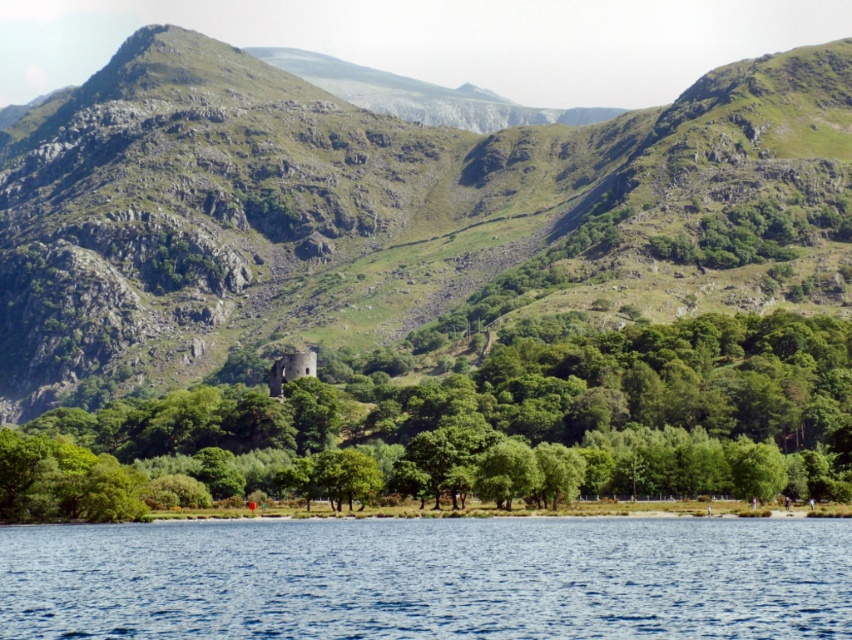
Question: Is green rocky mountain at center above blue liquid water at lower center?

Choices:
 (A) no
 (B) yes

Answer: (B)

Question: Which point is farther from the camera taking this photo?

Choices:
 (A) (32, 275)
 (B) (308, 442)

Answer: (A)

Question: Does green rocky mountain at center appear over green leafy tree at center?

Choices:
 (A) no
 (B) yes

Answer: (B)

Question: Among these points, which one is farthest from the camera?

Choices:
 (A) (337, 490)
 (B) (124, 579)
 (C) (262, 170)

Answer: (C)

Question: Which of these objects is positioned farthest from the green rocky mountain at center?

Choices:
 (A) green leafy tree at center
 (B) blue liquid water at lower center

Answer: (B)

Question: In this image, where is green rocky mountain at center located relative to blue liquid water at lower center?

Choices:
 (A) above
 (B) below

Answer: (A)